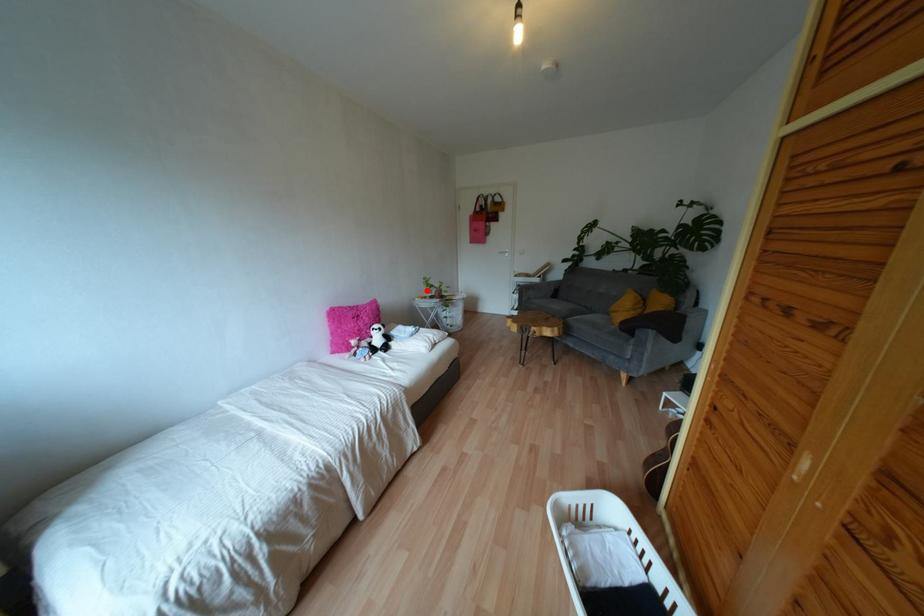
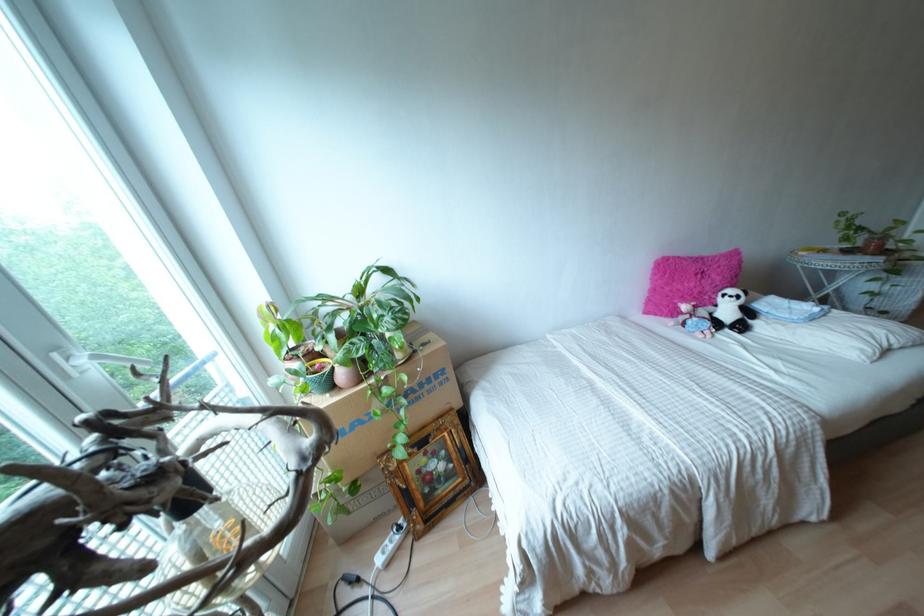
Question: I am providing you with two images of the same scene from different viewpoints. A red point is shown in image1. For the corresponding object point in image2, is it positioned nearer or farther from the camera?

Choices:
 (A) Nearer
 (B) Farther

Answer: (A)